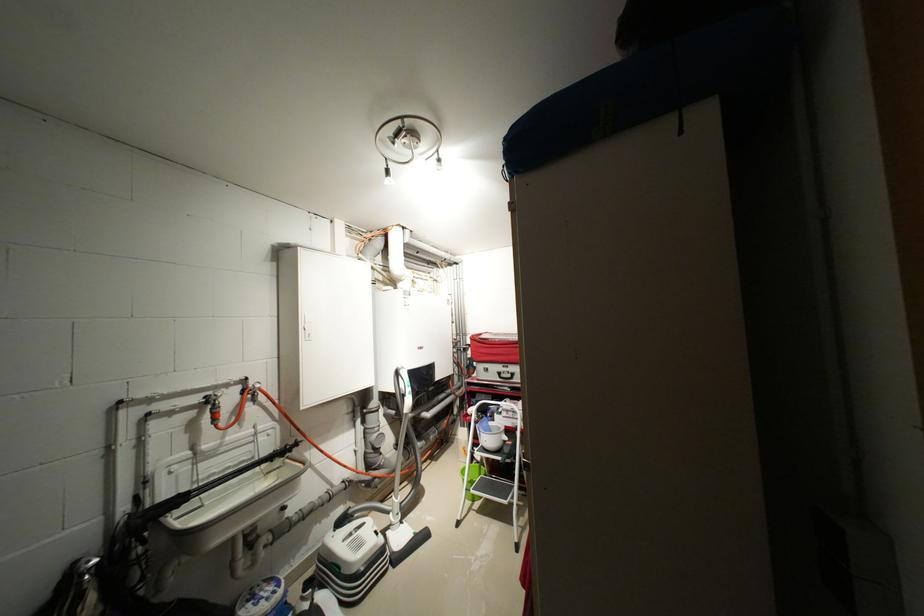
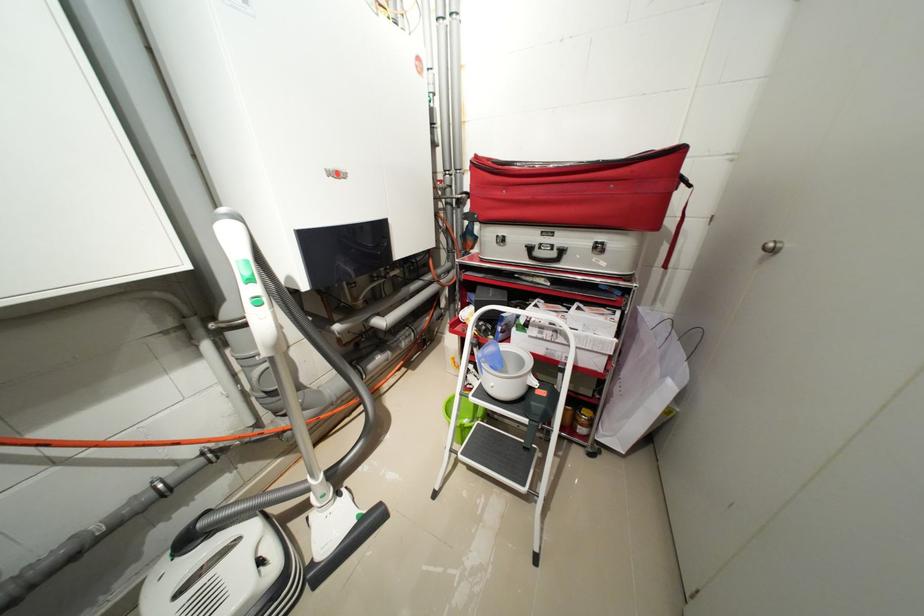
Question: Which direction would the cameraman need to move to produce the second image? Reply with the corresponding letter.

Choices:
 (A) Left
 (B) Right
 (C) Forward
 (D) Backward

Answer: (C)